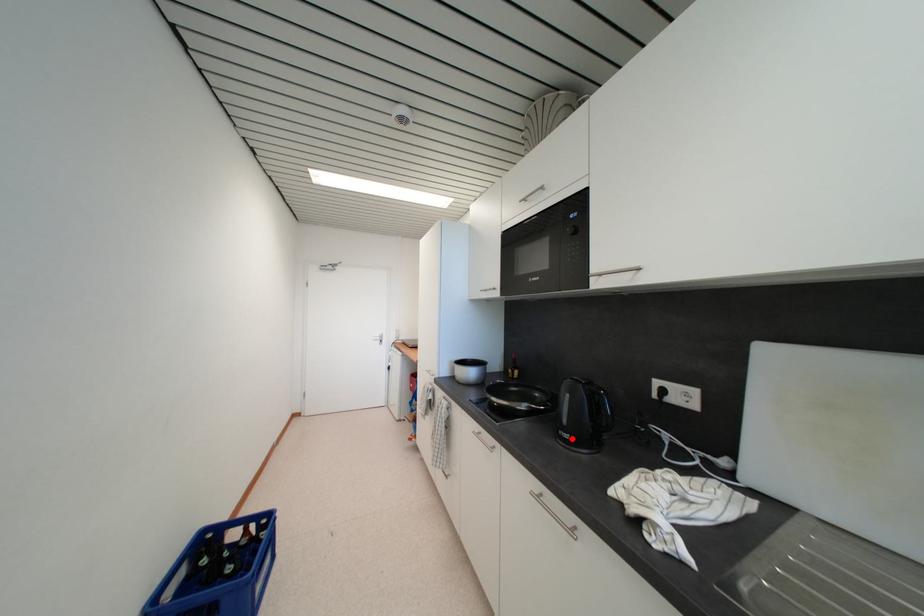
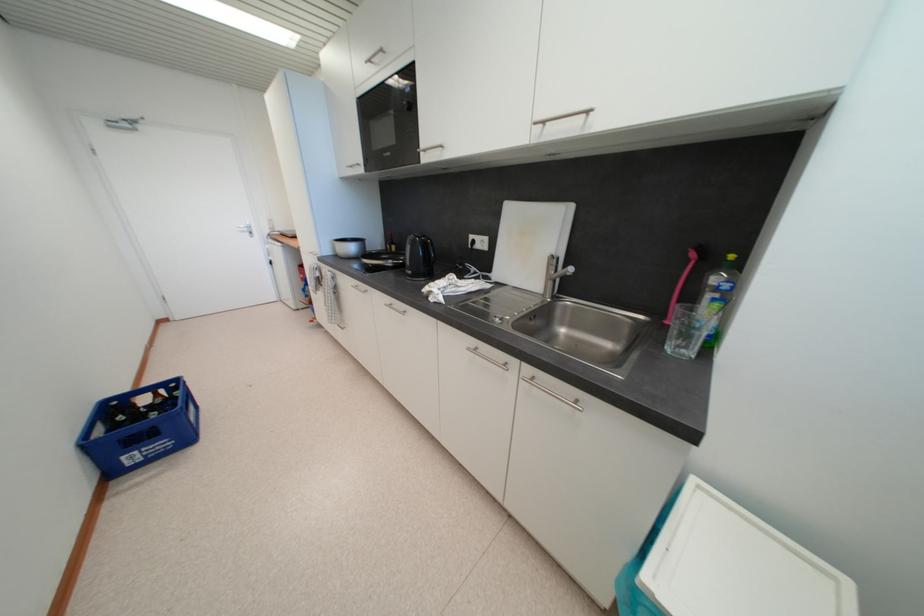
Find the pixel in the second image that matches the highlighted location in the first image.

(415, 275)